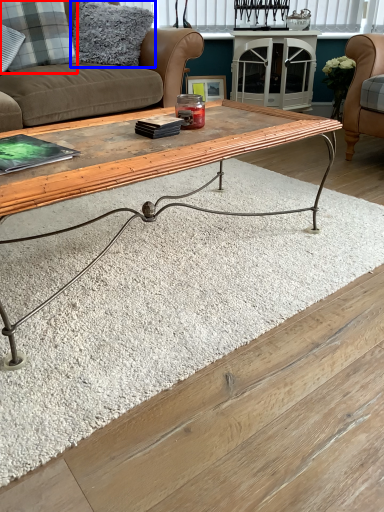
Question: Which object appears closest to the camera in this image, pillow (highlighted by a red box) or pillow (highlighted by a blue box)?

Choices:
 (A) pillow
 (B) pillow

Answer: (A)